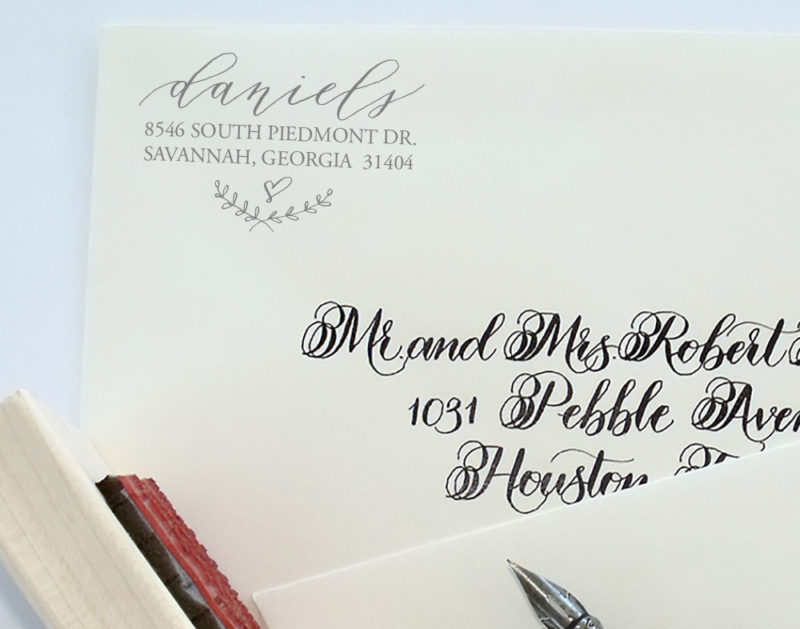
This screenshot has width=800, height=629. Identify the location of wooden stamp holder. (62, 546).